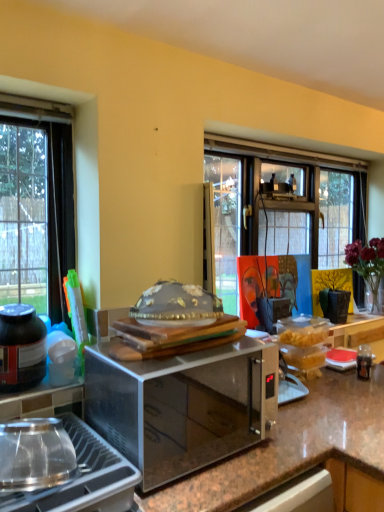
Question: Is translucent glass vase at upper right to the left of brown granite countertop at center from the viewer's perspective?

Choices:
 (A) no
 (B) yes

Answer: (A)

Question: Considering the relative sizes of translucent glass vase at upper right and brown granite countertop at center in the image provided, is translucent glass vase at upper right bigger than brown granite countertop at center?

Choices:
 (A) no
 (B) yes

Answer: (A)

Question: From the image's perspective, does translucent glass vase at upper right appear higher than brown granite countertop at center?

Choices:
 (A) yes
 (B) no

Answer: (A)

Question: Is brown granite countertop at center a part of translucent glass vase at upper right?

Choices:
 (A) no
 (B) yes

Answer: (A)

Question: From a real-world perspective, does translucent glass vase at upper right stand above brown granite countertop at center?

Choices:
 (A) no
 (B) yes

Answer: (B)

Question: Would you say translucent glass vase at upper right is a long distance from brown granite countertop at center?

Choices:
 (A) no
 (B) yes

Answer: (B)

Question: Is brown granite countertop at center closer to the viewer compared to black matte jar at lower left?

Choices:
 (A) yes
 (B) no

Answer: (A)

Question: Is brown granite countertop at center next to black matte jar at lower left?

Choices:
 (A) yes
 (B) no

Answer: (B)

Question: Can you confirm if brown granite countertop at center is smaller than black matte jar at lower left?

Choices:
 (A) yes
 (B) no

Answer: (B)

Question: Is brown granite countertop at center positioned with its back to black matte jar at lower left?

Choices:
 (A) yes
 (B) no

Answer: (B)

Question: From a real-world perspective, is brown granite countertop at center physically above black matte jar at lower left?

Choices:
 (A) yes
 (B) no

Answer: (B)

Question: Is brown granite countertop at center bigger than black matte jar at lower left?

Choices:
 (A) yes
 (B) no

Answer: (A)

Question: Does orange canvas painting at center have a smaller size compared to black matte jar at lower left?

Choices:
 (A) yes
 (B) no

Answer: (B)